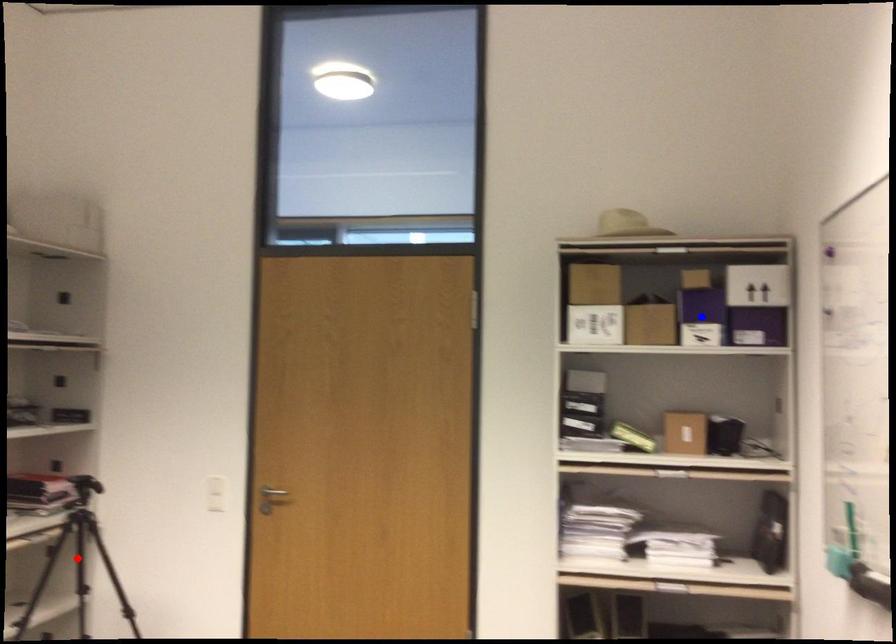
Question: Which of the two points in the image is closer to the camera?

Choices:
 (A) Blue point is closer.
 (B) Red point is closer.

Answer: (A)